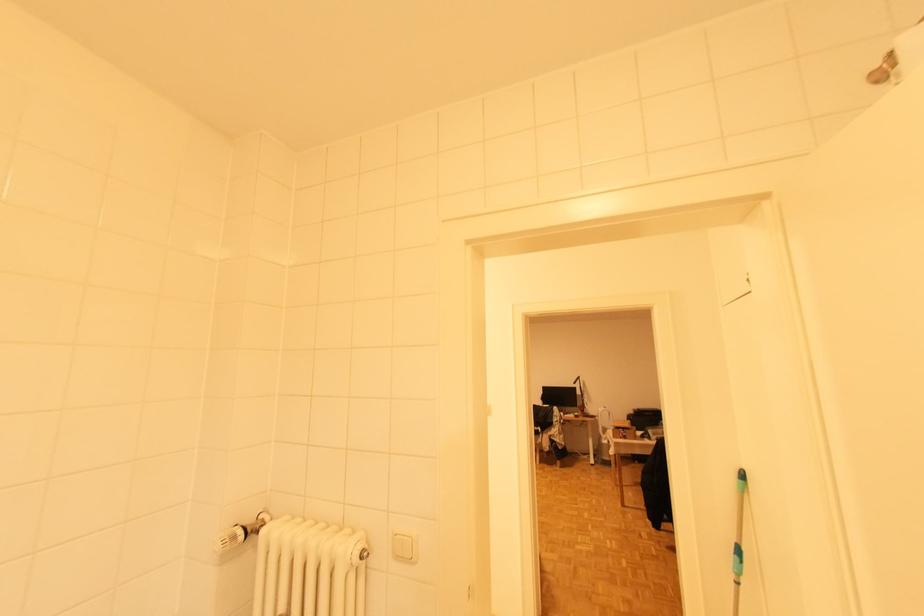
Identify the location of mop handle. (737, 540).